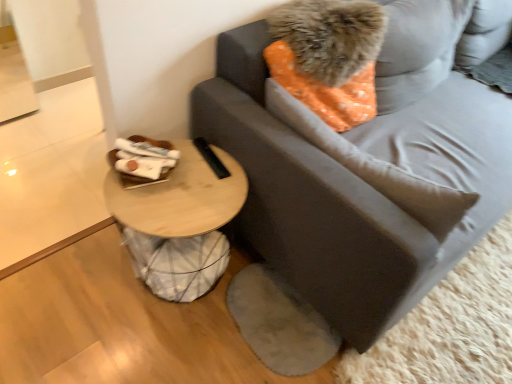
Question: Is gray fabric studio couch at center further to camera compared to orange dotted fabric pillow at upper right, the first pillow positioned from the top?

Choices:
 (A) no
 (B) yes

Answer: (A)

Question: From the image's perspective, is gray fabric studio couch at center below orange dotted fabric pillow at upper right, which is counted as the 2th pillow, starting from the bottom?

Choices:
 (A) yes
 (B) no

Answer: (A)

Question: Is gray fabric studio couch at center aimed at orange dotted fabric pillow at upper right, the first pillow positioned from the top?

Choices:
 (A) yes
 (B) no

Answer: (A)

Question: Can you confirm if gray fabric studio couch at center is shorter than orange dotted fabric pillow at upper right, the first pillow positioned from the top?

Choices:
 (A) no
 (B) yes

Answer: (A)

Question: Is gray fabric studio couch at center closer to the viewer compared to orange dotted fabric pillow at upper right, the first pillow positioned from the top?

Choices:
 (A) no
 (B) yes

Answer: (B)

Question: Is gray fabric studio couch at center not inside orange dotted fabric pillow at upper right, the first pillow positioned from the top?

Choices:
 (A) no
 (B) yes

Answer: (B)

Question: Considering the relative sizes of orange dotted fabric pillow at upper right, the first pillow positioned from the top, and gray fabric studio couch at center in the image provided, is orange dotted fabric pillow at upper right, the first pillow positioned from the top, wider than gray fabric studio couch at center?

Choices:
 (A) yes
 (B) no

Answer: (B)

Question: Is orange dotted fabric pillow at upper right, which is counted as the 2th pillow, starting from the bottom, looking in the opposite direction of gray fabric studio couch at center?

Choices:
 (A) yes
 (B) no

Answer: (A)

Question: From the image's perspective, is orange dotted fabric pillow at upper right, the first pillow positioned from the top, beneath gray fabric studio couch at center?

Choices:
 (A) yes
 (B) no

Answer: (B)

Question: Are orange dotted fabric pillow at upper right, which is counted as the 2th pillow, starting from the bottom, and gray fabric studio couch at center located far from each other?

Choices:
 (A) no
 (B) yes

Answer: (A)

Question: Can you confirm if orange dotted fabric pillow at upper right, which is counted as the 2th pillow, starting from the bottom, is bigger than gray fabric studio couch at center?

Choices:
 (A) yes
 (B) no

Answer: (B)

Question: Is orange dotted fabric pillow at upper right, the first pillow positioned from the top, shorter than gray fabric studio couch at center?

Choices:
 (A) no
 (B) yes

Answer: (B)

Question: Does woodenmaterial/texturetable at lower left have a greater width compared to gray fabric studio couch at center?

Choices:
 (A) no
 (B) yes

Answer: (A)